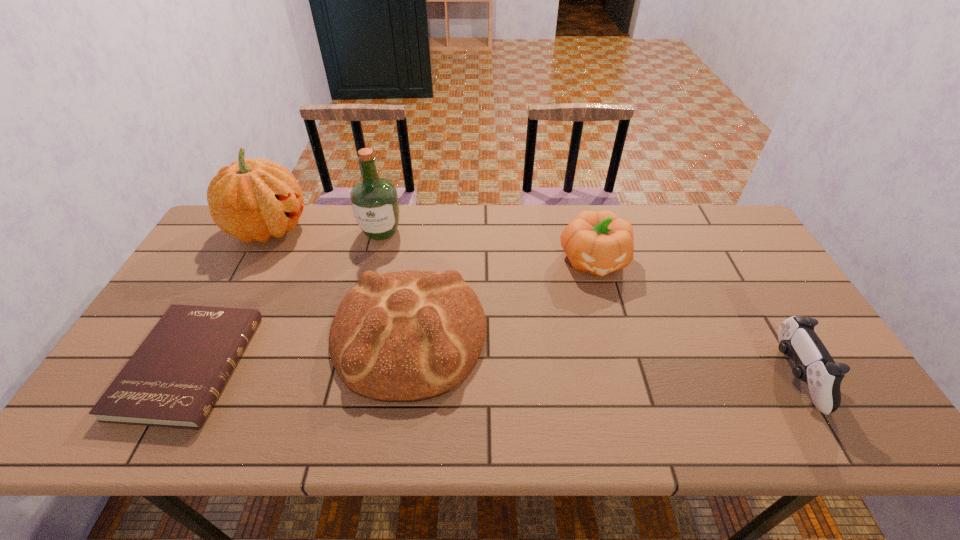
In order to click on free location that satisfies the following two spatial constraints: 1. on the front-facing side of the liquor; 2. on the right side of the bread in this screenshot , I will do `click(355, 335)`.

Find the location of `vacant area in the image that satisfies the following two spatial constraints: 1. on the carved face of the bread; 2. on the right side of the left pumpkin`. vacant area in the image that satisfies the following two spatial constraints: 1. on the carved face of the bread; 2. on the right side of the left pumpkin is located at coordinates (212, 335).

This screenshot has width=960, height=540. What are the coordinates of `vacant point that satisfies the following two spatial constraints: 1. on the front-facing side of the liquor; 2. on the left side of the bread` in the screenshot? It's located at (355, 335).